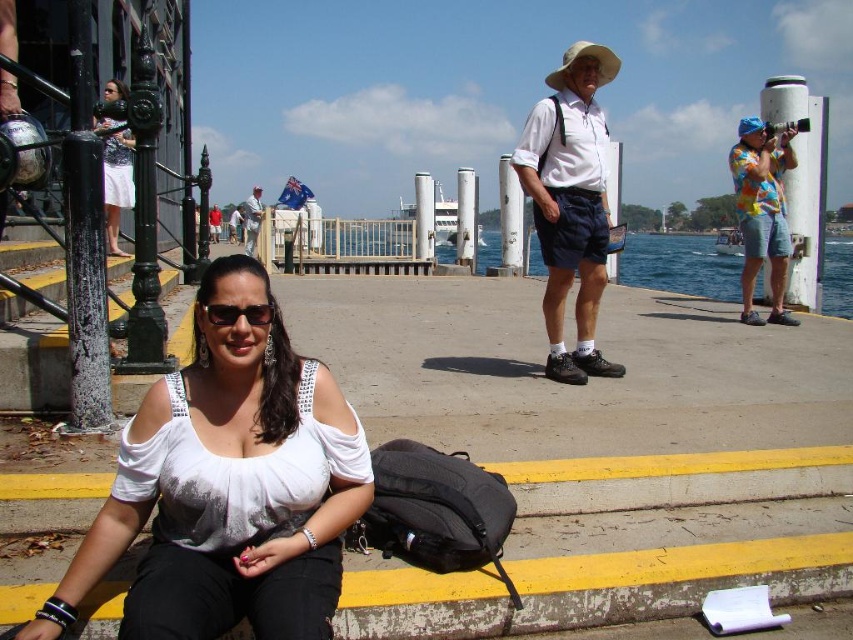
Between white matte shirt at center and blue water at center, which one is positioned lower?

white matte shirt at center is lower down.

Identify the location of white matte shirt at center. Image resolution: width=853 pixels, height=640 pixels. (570, 204).

From the picture: Does white matte blouse at lower left have a larger size compared to white fabric cowboy hat at upper center?

Incorrect, white matte blouse at lower left is not larger than white fabric cowboy hat at upper center.

Image resolution: width=853 pixels, height=640 pixels. What are the coordinates of `white matte blouse at lower left` in the screenshot? It's located at (228, 486).

Can you confirm if white fabric cowboy hat at upper center is bigger than white cotton shirt at center?

Yes, white fabric cowboy hat at upper center is bigger than white cotton shirt at center.

In the scene shown: Can you confirm if white fabric cowboy hat at upper center is shorter than white cotton shirt at center?

No, white fabric cowboy hat at upper center is not shorter than white cotton shirt at center.

Between point (616, 56) and point (244, 230), which one is positioned behind?

The point (244, 230) is behind.

The height and width of the screenshot is (640, 853). In order to click on white fabric cowboy hat at upper center in this screenshot , I will do `click(585, 54)`.